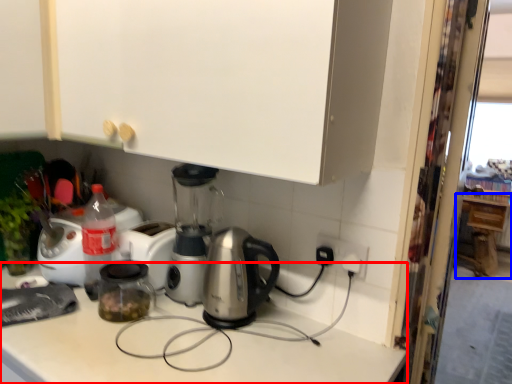
Question: Which object appears closest to the camera in this image, counter top (highlighted by a red box) or cabinetry (highlighted by a blue box)?

Choices:
 (A) counter top
 (B) cabinetry

Answer: (A)